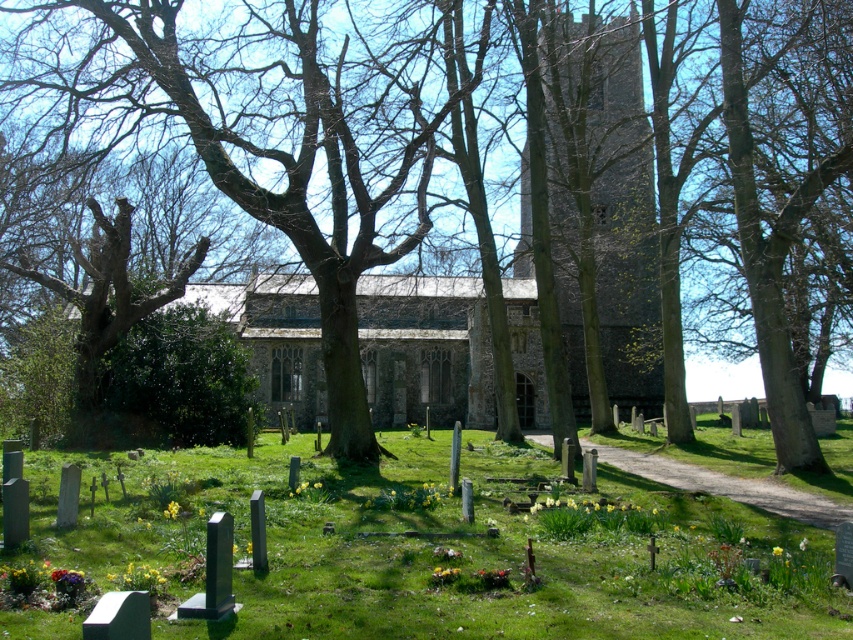
Measure the distance from green grassy at lower center to gray stone tower at center.

The distance of green grassy at lower center from gray stone tower at center is 21.07 meters.

Between point (746, 528) and point (616, 326), which one is positioned in front?

Point (746, 528) is more forward.

From the picture: Measure the distance between point (241, 609) and camera.

Point (241, 609) and camera are 8.19 meters apart from each other.

This screenshot has width=853, height=640. What are the coordinates of `green grassy at lower center` in the screenshot? It's located at (427, 550).